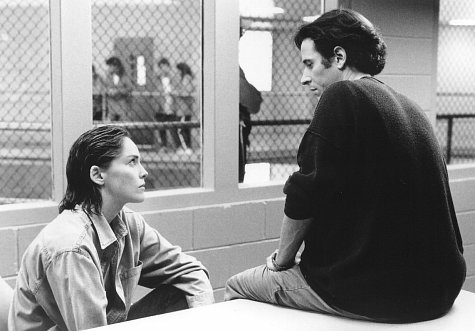
Locate an element on the screen. The height and width of the screenshot is (331, 475). brick wall is located at coordinates (419, 59), (211, 233).